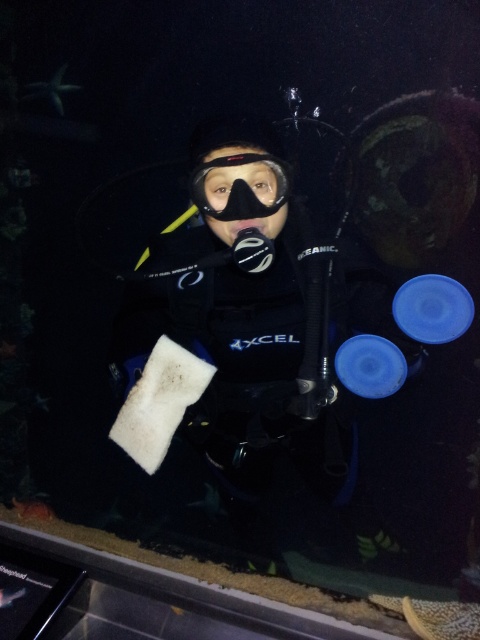
You are a scuba diver preparing to dive into the underwater scene shown. You notice the black matte wetsuit at center at coordinates point (237, 339). Can you confirm if this wetsuit is positioned exactly at the center of the image?

The black matte wetsuit at center is located at point (237, 339), so yes, it is positioned exactly at the center of the image.

You are a marine biologist observing the underwater scene. You notice the black matte wetsuit at center and the black matte snorkel mask at center. Which object is closer to you?

The black matte wetsuit at center is closer to you because it is further to the viewer than the black matte snorkel mask at center.